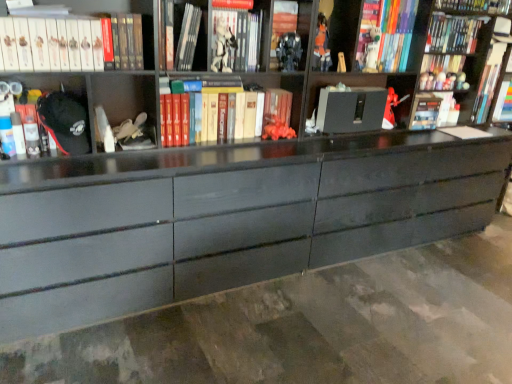
The width and height of the screenshot is (512, 384). I want to click on vacant area on top of matte red figurine at upper right, acting as the 7th book starting from the left (from a real-world perspective), so click(423, 91).